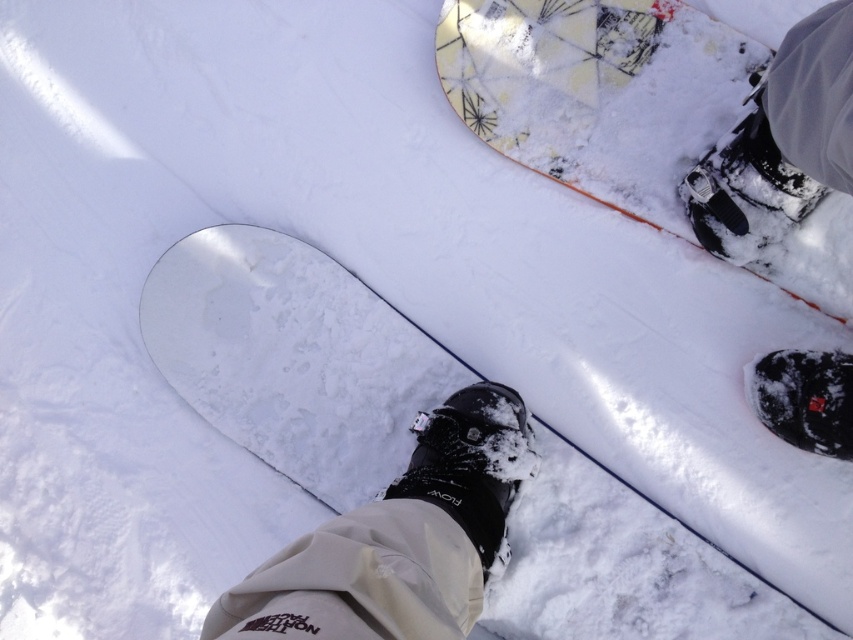
Is point (469, 429) positioned after point (770, 132)?

Yes.

In order to click on black matte boot at center in this screenshot , I will do `click(473, 464)`.

Where is `black matte boot at center`? This screenshot has height=640, width=853. black matte boot at center is located at coordinates (473, 464).

Where is `black matte boot at center`? black matte boot at center is located at coordinates (473, 464).

Does black matte boot at lower center lie in front of black matte boot at center?

That is True.

Who is higher up, black matte boot at lower center or black matte boot at center?

black matte boot at center is above.

Locate an element on the screen. The height and width of the screenshot is (640, 853). black matte boot at lower center is located at coordinates (399, 540).

Between white matte snowboard at center and black matte boot at lower center, which one appears on the right side from the viewer's perspective?

From the viewer's perspective, white matte snowboard at center appears more on the right side.

Is white matte snowboard at center thinner than black matte boot at lower center?

No.

From the picture: Who is more forward, (212,253) or (293,577)?

Point (293,577) is more forward.

At what (x,y) coordinates should I click in order to perform the action: click on white matte snowboard at center. Please return your answer as a coordinate pair (x, y). The image size is (853, 640). Looking at the image, I should click on (292, 356).